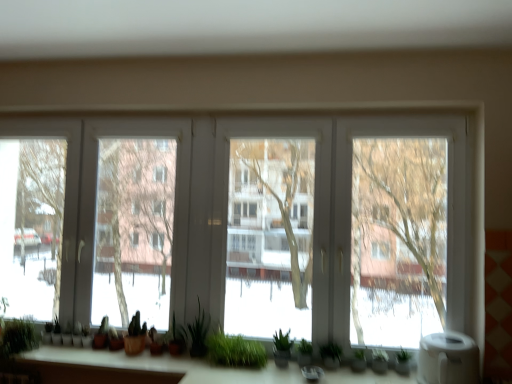
This screenshot has width=512, height=384. I want to click on vacant area that is in front of green matte plant at lower left, the fifth plant viewed from the right, so 91,352.